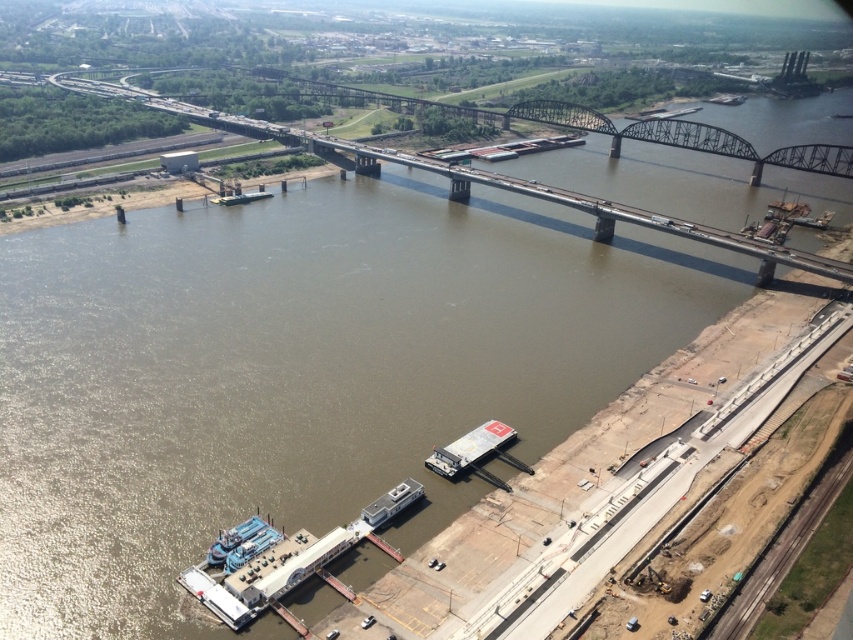
Question: Does metallic gray bridge at center lie in front of white matte barge at center?

Choices:
 (A) yes
 (B) no

Answer: (B)

Question: Among these objects, which one is nearest to the camera?

Choices:
 (A) metallic gray bridge at center
 (B) white matte barge at center

Answer: (B)

Question: Considering the relative positions of metallic gray bridge at center and white matte barge at center in the image provided, where is metallic gray bridge at center located with respect to white matte barge at center?

Choices:
 (A) left
 (B) right

Answer: (B)

Question: Which of the following is the closest to the observer?

Choices:
 (A) (643, 131)
 (B) (440, 465)

Answer: (B)

Question: Can you confirm if metallic gray bridge at center is positioned to the right of white matte barge at center?

Choices:
 (A) yes
 (B) no

Answer: (A)